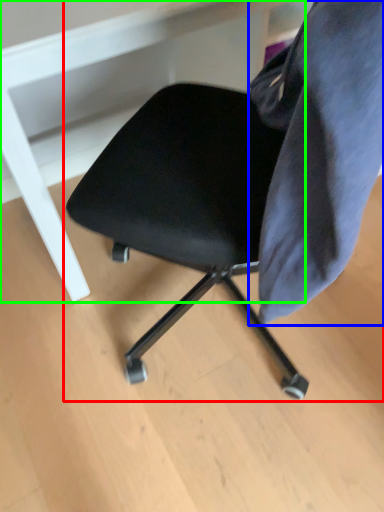
Question: Which object is the closest to the chair (highlighted by a red box)? Choose among these: fabric (highlighted by a blue box) or vanity (highlighted by a green box).

Choices:
 (A) fabric
 (B) vanity

Answer: (A)